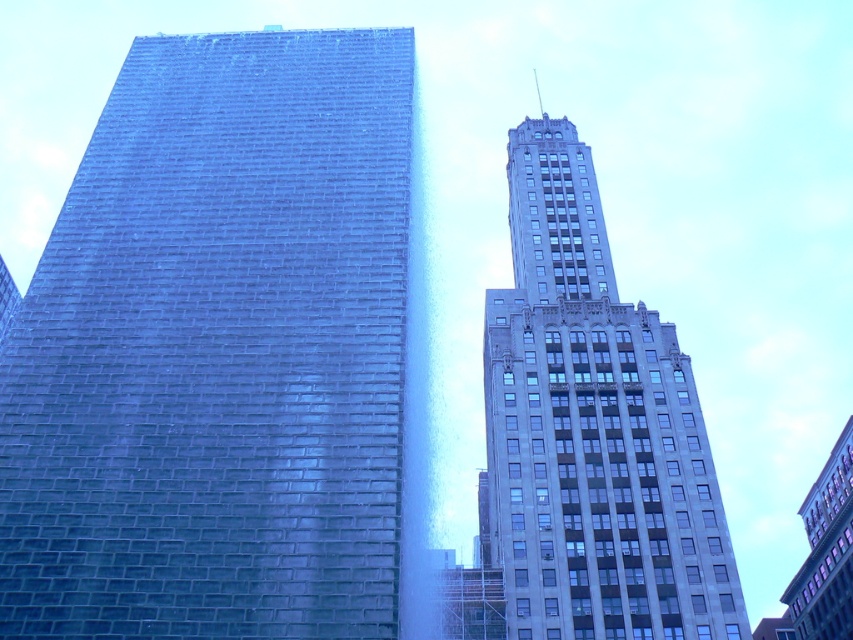
Between smooth glass tower at left and gray stone tower at upper right, which one appears on the right side from the viewer's perspective?

gray stone tower at upper right

Is smooth glass tower at left to the right of gray stone tower at upper right from the viewer's perspective?

In fact, smooth glass tower at left is to the left of gray stone tower at upper right.

Find the location of `smooth glass tower at left`. smooth glass tower at left is located at coordinates (218, 352).